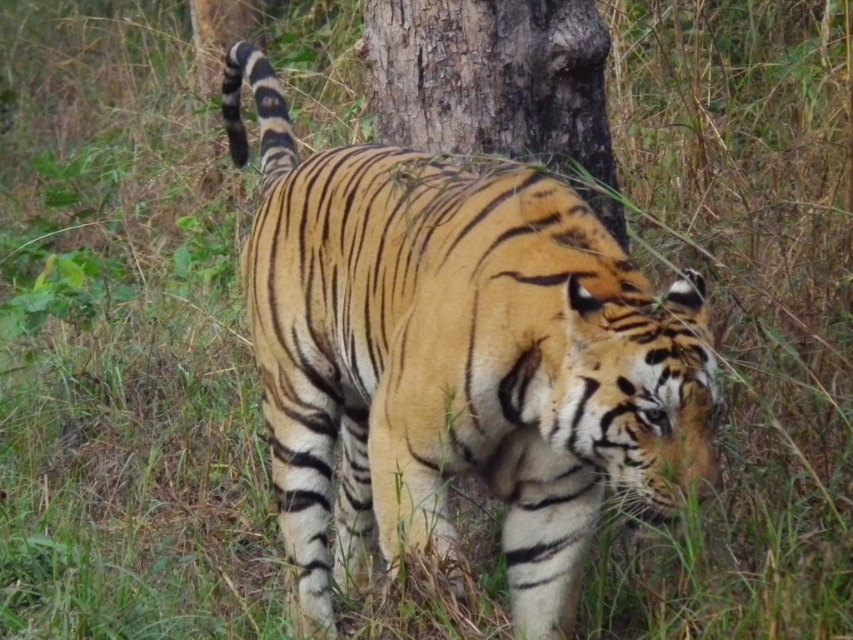
Question: Which of the following is the closest to the observer?

Choices:
 (A) (496, 61)
 (B) (331, 257)

Answer: (B)

Question: Which point is closer to the camera taking this photo?

Choices:
 (A) 598,289
 (B) 364,29

Answer: (A)

Question: Does orange-yellow fur tiger at center appear on the right side of rough bark tree at center?

Choices:
 (A) no
 (B) yes

Answer: (A)

Question: Is orange-yellow fur tiger at center above rough bark tree at center?

Choices:
 (A) no
 (B) yes

Answer: (A)

Question: Where is orange-yellow fur tiger at center located in relation to rough bark tree at center in the image?

Choices:
 (A) above
 (B) below

Answer: (B)